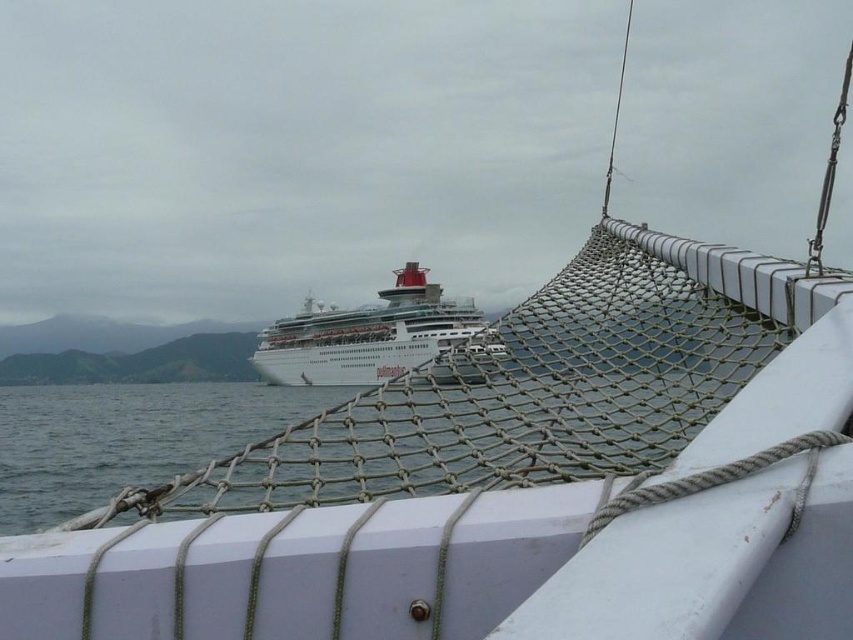
Which is behind, point (85, 504) or point (296, 320)?

Point (296, 320)

Locate an element on the screen. This screenshot has width=853, height=640. clear water at center is located at coordinates (129, 420).